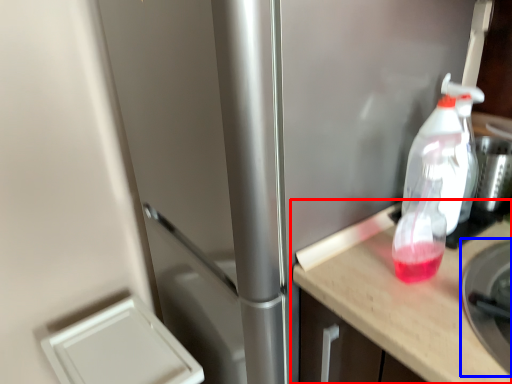
Question: Which object is closer to the camera taking this photo, countertop (highlighted by a red box) or appliance (highlighted by a blue box)?

Choices:
 (A) countertop
 (B) appliance

Answer: (B)